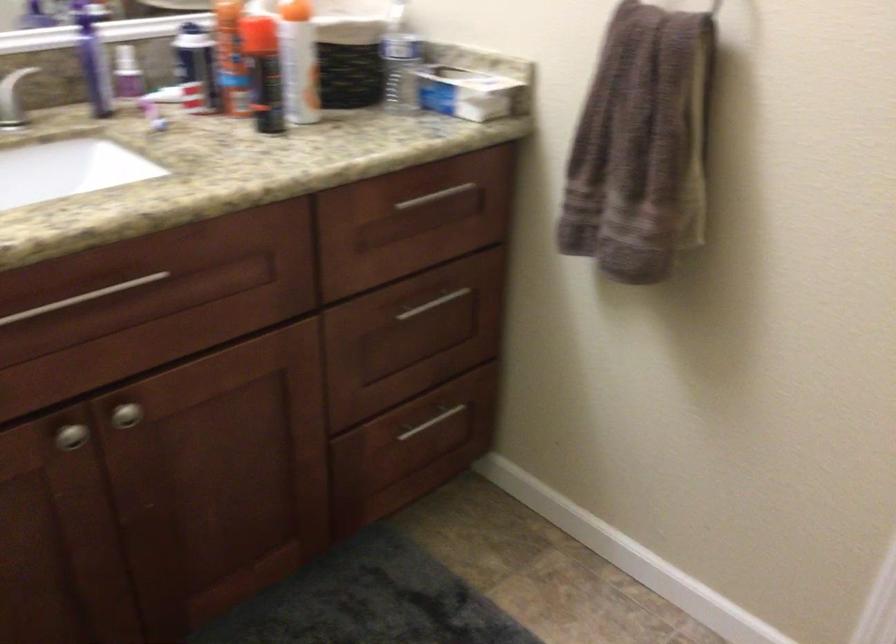
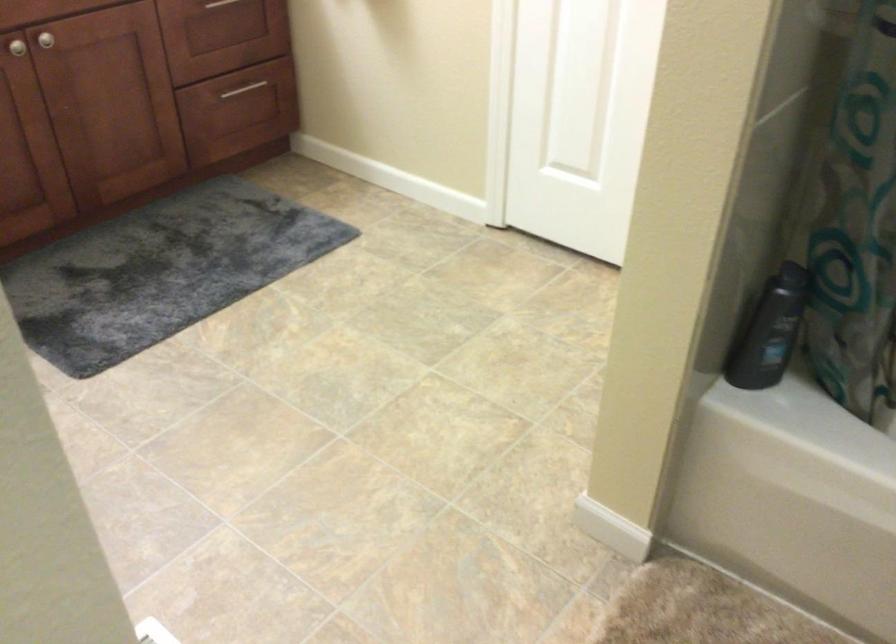
Question: What movement of the cameraman would produce the second image?

Choices:
 (A) Left
 (B) Right
 (C) Forward
 (D) Backward

Answer: (D)